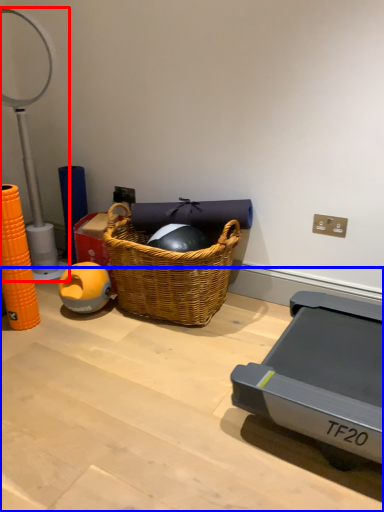
Question: Which point is closer to the camera, table lamp (highlighted by a red box) or table (highlighted by a blue box)?

Choices:
 (A) table lamp
 (B) table

Answer: (B)